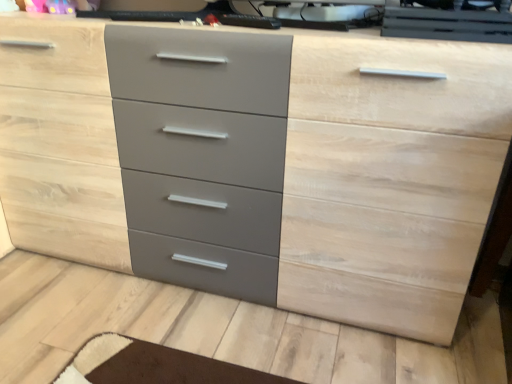
Question: Is point (349, 8) positioned closer to the camera than point (472, 14)?

Choices:
 (A) closer
 (B) farther

Answer: (B)

Question: Is matte black desktop computer at upper center, the 1th desktop computer from the left, in front of or behind glossy black desktop computer at upper center, the 1th desktop computer from the right, in the image?

Choices:
 (A) behind
 (B) front

Answer: (A)

Question: Looking at their shapes, would you say matte black desktop computer at upper center, the 1th desktop computer from the left, is wider or thinner than glossy black desktop computer at upper center, the 1th desktop computer from the right?

Choices:
 (A) wide
 (B) thin

Answer: (B)

Question: From a real-world perspective, is glossy black desktop computer at upper center, which is counted as the second desktop computer, starting from the left, above or below matte black desktop computer at upper center, the 1th desktop computer from the left?

Choices:
 (A) below
 (B) above

Answer: (B)

Question: Relative to matte black desktop computer at upper center, the 1th desktop computer from the left, is glossy black desktop computer at upper center, the 1th desktop computer from the right, in front or behind?

Choices:
 (A) front
 (B) behind

Answer: (A)

Question: Considering the positions of point (430, 14) and point (365, 13), is point (430, 14) closer or farther from the camera than point (365, 13)?

Choices:
 (A) closer
 (B) farther

Answer: (A)

Question: Is glossy black desktop computer at upper center, the 1th desktop computer from the right, situated inside matte black desktop computer at upper center, the 1th desktop computer from the left, or outside?

Choices:
 (A) inside
 (B) outside

Answer: (B)